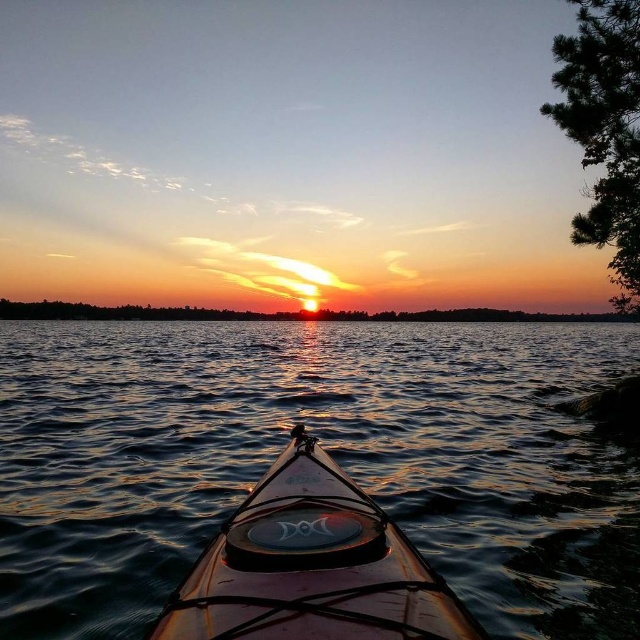
Question: Does glossy water at center have a greater width compared to smooth orange sky at center?

Choices:
 (A) yes
 (B) no

Answer: (B)

Question: Does glossy water at center appear on the right side of translucent brown canoe at center?

Choices:
 (A) no
 (B) yes

Answer: (B)

Question: Does glossy water at center appear on the right side of smooth orange sky at center?

Choices:
 (A) yes
 (B) no

Answer: (A)

Question: Which of the following is the farthest from the observer?

Choices:
 (A) glossy water at center
 (B) translucent brown canoe at center

Answer: (A)

Question: Which point is farther from the camera taking this photo?

Choices:
 (A) (512, 320)
 (B) (3, 333)

Answer: (A)

Question: Which object is the farthest from the glossy water at center?

Choices:
 (A) translucent brown canoe at center
 (B) smooth orange sky at center

Answer: (B)